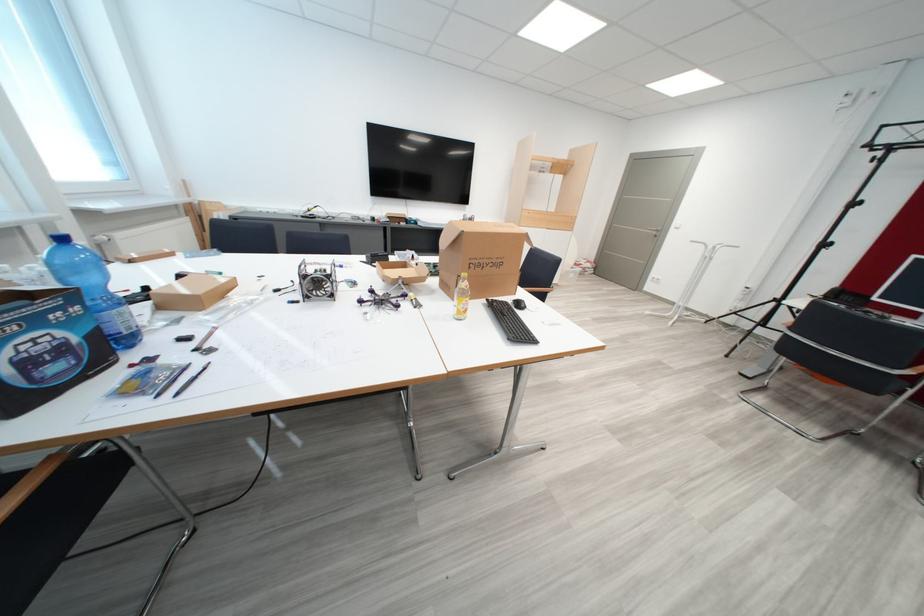
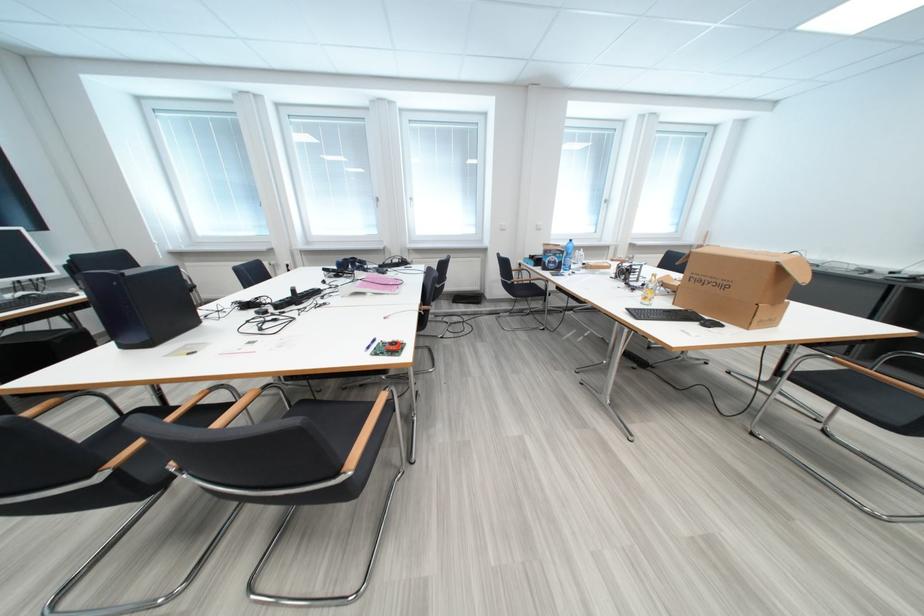
Locate, in the second image, the point that corresponds to (196,201) in the first image.

(711, 245)